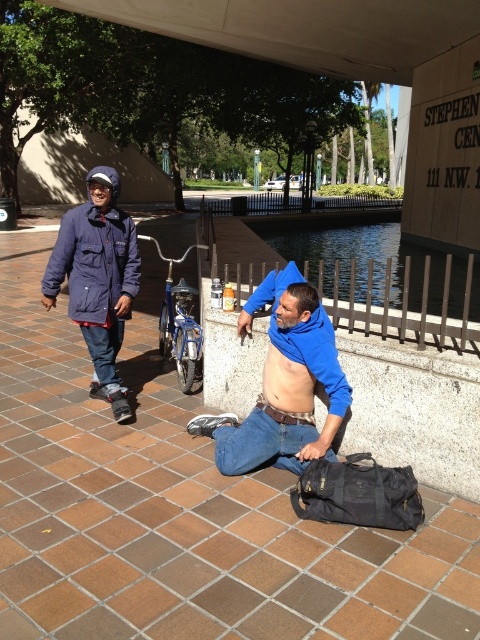
You are a photographer trying to capture both the blue matte shirt at center and the navy blue jacket at left in a single frame. Based on their positions, which one will appear smaller in the photo?

The blue matte shirt at center will appear smaller in the photo because it has a lesser height compared to the navy blue jacket at left.

You are a photographer trying to capture a candid shot of the blue matte shirt at center and the brown tile pavement at center. Based on their sizes in the image, which object should you focus on first to ensure both are in frame?

The brown tile pavement at center occupies less space than the blue matte shirt at center, so you should focus on the blue matte shirt at center first to ensure both are in frame.